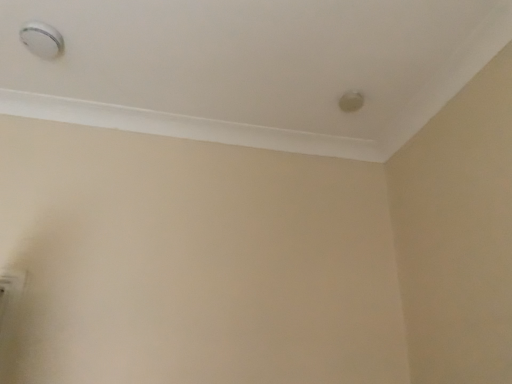
The height and width of the screenshot is (384, 512). I want to click on matte white knob at upper right, positioned as the second knob in top-to-bottom order, so click(351, 101).

This screenshot has width=512, height=384. Describe the element at coordinates (351, 101) in the screenshot. I see `matte white knob at upper right, which is counted as the 2th knob, starting from the front` at that location.

Describe the element at coordinates (42, 40) in the screenshot. The image size is (512, 384). I see `white plastic smoke detector at upper left, placed as the 1th knob when sorted from left to right` at that location.

Measure the distance between white plastic smoke detector at upper left, the second knob in the back-to-front sequence, and camera.

white plastic smoke detector at upper left, the second knob in the back-to-front sequence, and camera are 4.98 feet apart from each other.

What is the approximate height of white plastic smoke detector at upper left, the second knob positioned from the bottom?

white plastic smoke detector at upper left, the second knob positioned from the bottom, is 1.97 inches in height.

Locate an element on the screen. The width and height of the screenshot is (512, 384). white plastic smoke detector at upper left, placed as the 1th knob when sorted from front to back is located at coordinates (42, 40).

Measure the distance between point [59,43] and camera.

They are 5.25 feet apart.

The width and height of the screenshot is (512, 384). Identify the location of matte white knob at upper right, positioned as the second knob in top-to-bottom order. (351, 101).

Which object is positioned more to the right, white plastic smoke detector at upper left, placed as the 1th knob when sorted from left to right, or matte white knob at upper right, which ranks as the first knob in right-to-left order?

matte white knob at upper right, which ranks as the first knob in right-to-left order.

Is white plastic smoke detector at upper left, the first knob viewed from the top, behind matte white knob at upper right, the first knob from the bottom?

That is False.

Does point (58, 50) appear closer or farther from the camera than point (352, 100)?

Point (58, 50) appears to be closer to the viewer than point (352, 100).

From the image's perspective, which is above, white plastic smoke detector at upper left, the second knob positioned from the bottom, or matte white knob at upper right, which is counted as the 2th knob, starting from the front?

white plastic smoke detector at upper left, the second knob positioned from the bottom.

From a real-world perspective, which object stands above the other?

matte white knob at upper right, the 1th knob viewed from the back, from a real-world perspective.

Which object is thinner, white plastic smoke detector at upper left, the second knob positioned from the bottom, or matte white knob at upper right, the first knob from the bottom?

With smaller width is matte white knob at upper right, the first knob from the bottom.

Who is shorter, white plastic smoke detector at upper left, the first knob viewed from the top, or matte white knob at upper right, which is counted as the 2th knob, starting from the front?

With less height is matte white knob at upper right, which is counted as the 2th knob, starting from the front.

Can you confirm if white plastic smoke detector at upper left, placed as the 1th knob when sorted from front to back, is bigger than matte white knob at upper right, which is counted as the 2th knob, starting from the front?

Yes, white plastic smoke detector at upper left, placed as the 1th knob when sorted from front to back, is bigger than matte white knob at upper right, which is counted as the 2th knob, starting from the front.

Choose the correct answer: Is white plastic smoke detector at upper left, the second knob positioned from the bottom, inside matte white knob at upper right, positioned as the second knob in top-to-bottom order, or outside it?

white plastic smoke detector at upper left, the second knob positioned from the bottom, is outside matte white knob at upper right, positioned as the second knob in top-to-bottom order.

Is white plastic smoke detector at upper left, acting as the 2th knob starting from the right, directly adjacent to matte white knob at upper right, positioned as the second knob in top-to-bottom order?

No, white plastic smoke detector at upper left, acting as the 2th knob starting from the right, is not with matte white knob at upper right, positioned as the second knob in top-to-bottom order.

Could you tell me if white plastic smoke detector at upper left, the second knob in the back-to-front sequence, is facing matte white knob at upper right, the first knob from the bottom?

Yes, white plastic smoke detector at upper left, the second knob in the back-to-front sequence, is turned towards matte white knob at upper right, the first knob from the bottom.

How distant is white plastic smoke detector at upper left, the second knob positioned from the bottom, from matte white knob at upper right, arranged as the second knob when viewed from the left?

white plastic smoke detector at upper left, the second knob positioned from the bottom, is 3.94 feet from matte white knob at upper right, arranged as the second knob when viewed from the left.

This screenshot has height=384, width=512. I want to click on knob that is below the white plastic smoke detector at upper left, placed as the 1th knob when sorted from left to right (from the image's perspective), so click(351, 101).

Based on the photo, is matte white knob at upper right, positioned as the second knob in top-to-bottom order, at the right side of white plastic smoke detector at upper left, the second knob positioned from the bottom?

Correct, you'll find matte white knob at upper right, positioned as the second knob in top-to-bottom order, to the right of white plastic smoke detector at upper left, the second knob positioned from the bottom.

Considering their positions, is matte white knob at upper right, the 1th knob viewed from the back, located in front of or behind white plastic smoke detector at upper left, the first knob viewed from the top?

matte white knob at upper right, the 1th knob viewed from the back, is positioned farther from the viewer than white plastic smoke detector at upper left, the first knob viewed from the top.

Is point (338, 105) closer or farther from the camera than point (42, 42)?

Point (338, 105) appears to be farther away from the viewer than point (42, 42).

Looking at this image, from the image's perspective, is matte white knob at upper right, arranged as the second knob when viewed from the left, under white plastic smoke detector at upper left, the first knob viewed from the top?

Yes.

From a real-world perspective, does matte white knob at upper right, which is counted as the 2th knob, starting from the front, stand above white plastic smoke detector at upper left, the second knob in the back-to-front sequence?

Indeed, from a real-world perspective, matte white knob at upper right, which is counted as the 2th knob, starting from the front, stands above white plastic smoke detector at upper left, the second knob in the back-to-front sequence.

In terms of width, does matte white knob at upper right, positioned as the second knob in top-to-bottom order, look wider or thinner when compared to white plastic smoke detector at upper left, the first knob viewed from the top?

In the image, matte white knob at upper right, positioned as the second knob in top-to-bottom order, appears to be more narrow than white plastic smoke detector at upper left, the first knob viewed from the top.

Considering the relative sizes of matte white knob at upper right, positioned as the second knob in top-to-bottom order, and white plastic smoke detector at upper left, acting as the 2th knob starting from the right, in the image provided, is matte white knob at upper right, positioned as the second knob in top-to-bottom order, shorter than white plastic smoke detector at upper left, acting as the 2th knob starting from the right,?

Correct, matte white knob at upper right, positioned as the second knob in top-to-bottom order, is not as tall as white plastic smoke detector at upper left, acting as the 2th knob starting from the right.

Based on their sizes in the image, would you say matte white knob at upper right, the 1th knob viewed from the back, is bigger or smaller than white plastic smoke detector at upper left, placed as the 1th knob when sorted from left to right?

Considering their sizes, matte white knob at upper right, the 1th knob viewed from the back, takes up less space than white plastic smoke detector at upper left, placed as the 1th knob when sorted from left to right.

Is matte white knob at upper right, which is counted as the 2th knob, starting from the front, surrounding white plastic smoke detector at upper left, placed as the 1th knob when sorted from left to right?

Actually, white plastic smoke detector at upper left, placed as the 1th knob when sorted from left to right, is outside matte white knob at upper right, which is counted as the 2th knob, starting from the front.

Is the surface of matte white knob at upper right, positioned as the second knob in top-to-bottom order, in direct contact with white plastic smoke detector at upper left, the second knob positioned from the bottom?

They are not placed beside each other.

Based on the photo, is matte white knob at upper right, arranged as the second knob when viewed from the left, facing away from white plastic smoke detector at upper left, the second knob positioned from the bottom?

No.

How different are the orientations of matte white knob at upper right, positioned as the second knob in top-to-bottom order, and white plastic smoke detector at upper left, the first knob viewed from the top, in degrees?

The angular difference between matte white knob at upper right, positioned as the second knob in top-to-bottom order, and white plastic smoke detector at upper left, the first knob viewed from the top, is 180 degrees.

Could you measure the distance between matte white knob at upper right, which ranks as the first knob in right-to-left order, and white plastic smoke detector at upper left, the first knob viewed from the top?

matte white knob at upper right, which ranks as the first knob in right-to-left order, is 1.20 meters away from white plastic smoke detector at upper left, the first knob viewed from the top.

Where is `knob above the matte white knob at upper right, positioned as the second knob in top-to-bottom order (from the image's perspective)`? This screenshot has height=384, width=512. knob above the matte white knob at upper right, positioned as the second knob in top-to-bottom order (from the image's perspective) is located at coordinates (42, 40).

You are a GUI agent. You are given a task and a screenshot of the screen. Output one action in this format:
    pyautogui.click(x=<x>, y=<y>)
    Task: Click on the knob located on the right of white plastic smoke detector at upper left, placed as the 1th knob when sorted from front to back
    Image resolution: width=512 pixels, height=384 pixels.
    Given the screenshot: What is the action you would take?
    [351, 101]

I want to click on knob below the white plastic smoke detector at upper left, placed as the 1th knob when sorted from left to right (from the image's perspective), so click(351, 101).